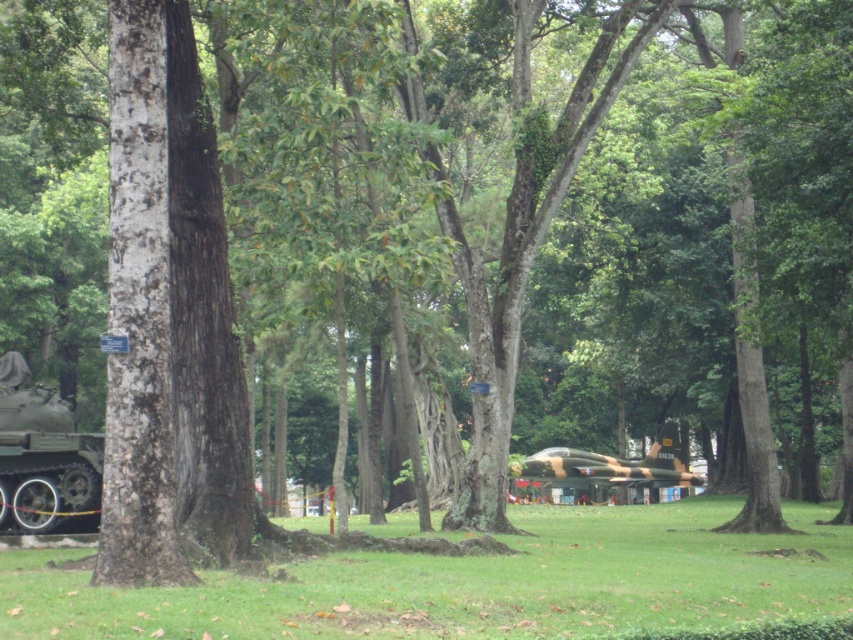
You are standing in the park and see two points marked in the scene. Which point is closer to you, point (80,461) or point (682,467)?

Point (80,461) is in front of point (682,467), so it is closer to you.

You are a military engineer inspecting the park. You see the matte green tank at left and the camouflage paint tank at center. Which one is shorter in height?

The matte green tank at left is shorter in height compared to the camouflage paint tank at center.

You are standing in the park and see a large tree trunk on the left side. There is also a point marked at coordinate (44,458). What object does this coordinate correspond to?

The point at coordinate (44,458) corresponds to the matte green tank at left.